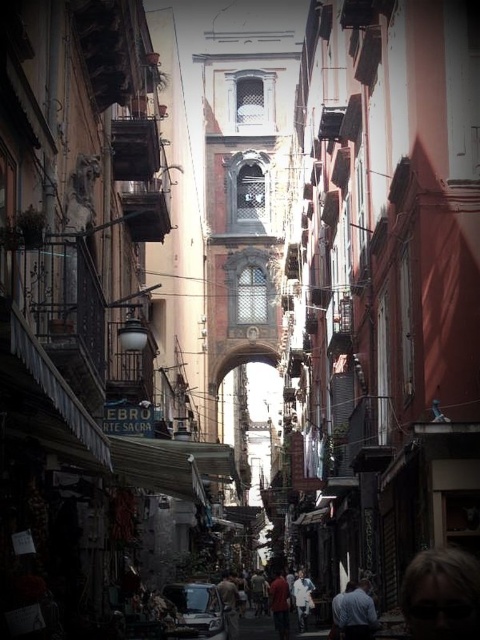
Question: Does blue fabric shirt at lower right appear on the left side of white cotton shirt at center?

Choices:
 (A) no
 (B) yes

Answer: (A)

Question: Based on their relative distances, which object is nearer to the blue fabric shirt at lower right?

Choices:
 (A) matte red shirt at center
 (B) white cotton shirt at center

Answer: (A)

Question: Is matte red shirt at center positioned at the back of white cotton shirt at center?

Choices:
 (A) no
 (B) yes

Answer: (A)

Question: Estimate the real-world distances between objects in this image. Which object is closer to the white cotton shirt at center?

Choices:
 (A) matte red shirt at center
 (B) blue fabric shirt at lower right

Answer: (A)

Question: Does matte red shirt at center have a larger size compared to white cotton shirt at center?

Choices:
 (A) yes
 (B) no

Answer: (A)

Question: Which point appears closest to the camera in this image?

Choices:
 (A) (299, 609)
 (B) (360, 600)

Answer: (B)